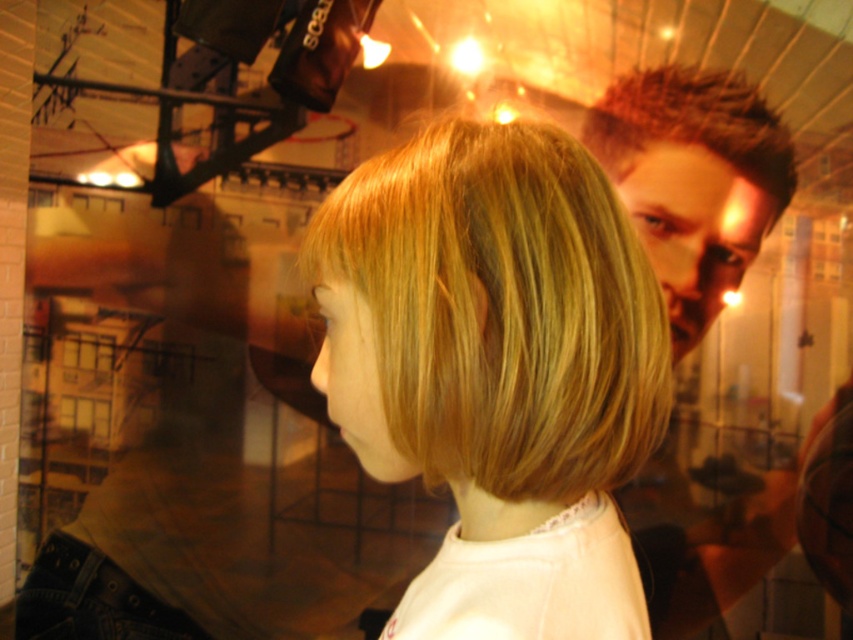
Can you confirm if blonde hair at center is taller than spiky brown hair at upper right?

No, blonde hair at center is not taller than spiky brown hair at upper right.

Describe the element at coordinates (494, 337) in the screenshot. I see `blonde hair at center` at that location.

This screenshot has height=640, width=853. Find the location of `blonde hair at center`. blonde hair at center is located at coordinates point(494,337).

Does slicked hair at upper right appear on the right side of denim at lower left?

Correct, you'll find slicked hair at upper right to the right of denim at lower left.

Where is `slicked hair at upper right`? slicked hair at upper right is located at coordinates (693, 180).

You are a GUI agent. You are given a task and a screenshot of the screen. Output one action in this format:
    pyautogui.click(x=<x>, y=<y>)
    Task: Click on the slicked hair at upper right
    The image size is (853, 640).
    Given the screenshot: What is the action you would take?
    pyautogui.click(x=693, y=180)

Based on the photo, which is more to the left, blonde hair at center or slicked hair at upper right?

From the viewer's perspective, blonde hair at center appears more on the left side.

Is point (311, 237) positioned in front of point (625, 83)?

Yes, it is in front of point (625, 83).

Locate an element on the screen. blonde hair at center is located at coordinates (494, 337).